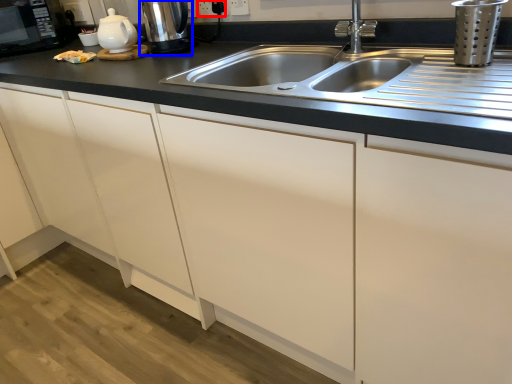
Question: Which object is closer to the camera taking this photo, electric outlet (highlighted by a red box) or coffee machine (highlighted by a blue box)?

Choices:
 (A) electric outlet
 (B) coffee machine

Answer: (B)